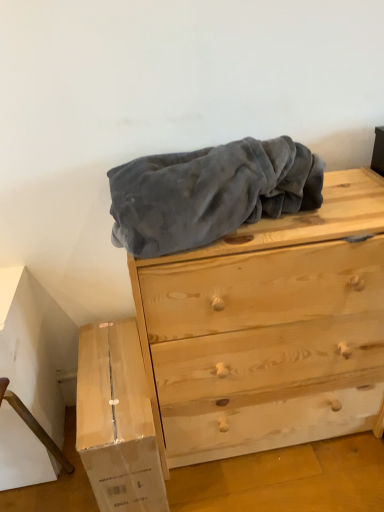
Question: Choose the correct answer: Is white cardboard box at lower left inside light brown wood chest of drawers at center or outside it?

Choices:
 (A) outside
 (B) inside

Answer: (A)

Question: Considering the positions of white cardboard box at lower left and light brown wood chest of drawers at center in the image, is white cardboard box at lower left taller or shorter than light brown wood chest of drawers at center?

Choices:
 (A) short
 (B) tall

Answer: (A)

Question: Considering the positions of point (142, 497) and point (336, 182), is point (142, 497) closer or farther from the camera than point (336, 182)?

Choices:
 (A) farther
 (B) closer

Answer: (B)

Question: From the image's perspective, is light brown wood chest of drawers at center located above or below white cardboard box at lower left?

Choices:
 (A) above
 (B) below

Answer: (A)

Question: Looking at the image, does light brown wood chest of drawers at center seem bigger or smaller compared to white cardboard box at lower left?

Choices:
 (A) small
 (B) big

Answer: (B)

Question: Is light brown wood chest of drawers at center in front of or behind white cardboard box at lower left in the image?

Choices:
 (A) behind
 (B) front

Answer: (B)

Question: In terms of height, does light brown wood chest of drawers at center look taller or shorter compared to white cardboard box at lower left?

Choices:
 (A) short
 (B) tall

Answer: (B)